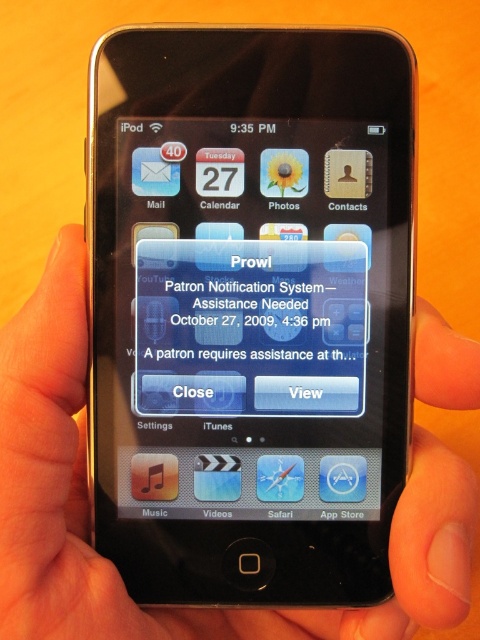
Between black matte hand at center and white matte text message at center, which one has more height?

black matte hand at center

Which is in front, point (94, 600) or point (280, 273)?

Point (94, 600)

Does point (56, 332) come farther from viewer compared to point (155, 356)?

That is False.

Find the location of `black matte hand at center`. black matte hand at center is located at coordinates (111, 563).